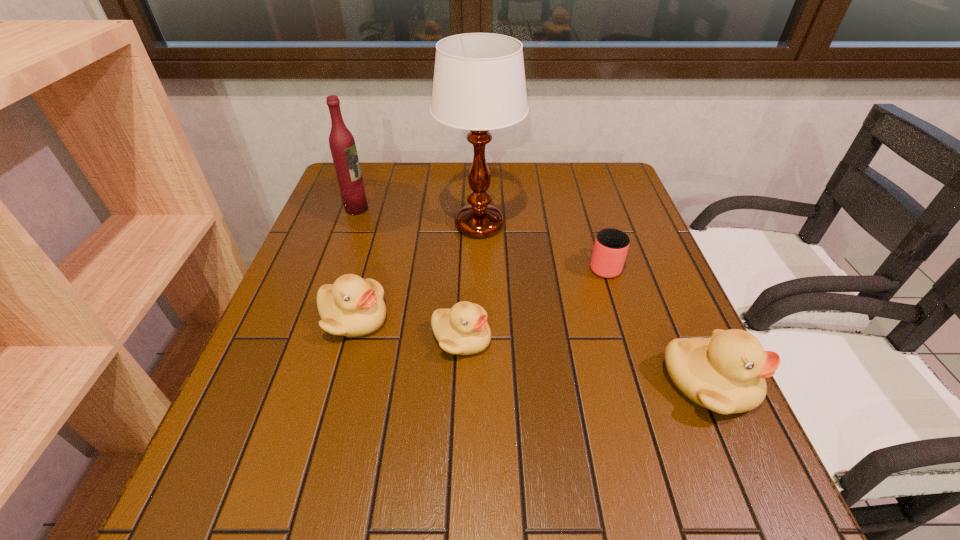
In order to click on cup that is at the right edge in this screenshot , I will do `click(611, 245)`.

Identify the location of object situated at the far left corner. (342, 144).

I want to click on object present at the near right corner, so click(x=725, y=373).

In the image, there is a desktop. Find the location of `vacant space at the far edge`. vacant space at the far edge is located at coordinates (517, 164).

The image size is (960, 540). Identify the location of free space at the near edge. (540, 426).

In the image, there is a desktop. In order to click on vacant space at the left edge in this screenshot , I will do [283, 322].

Locate an element on the screen. This screenshot has height=540, width=960. vacant region at the right edge is located at coordinates (636, 241).

Find the location of a particular element. free point between the second tallest object and the second shortest duckling is located at coordinates (355, 264).

What are the coordinates of `free space between the cup and the rightmost object` in the screenshot? It's located at (656, 325).

Locate an element on the screen. Image resolution: width=960 pixels, height=540 pixels. unoccupied position between the fourth tallest object and the second duckling from right to left is located at coordinates (408, 328).